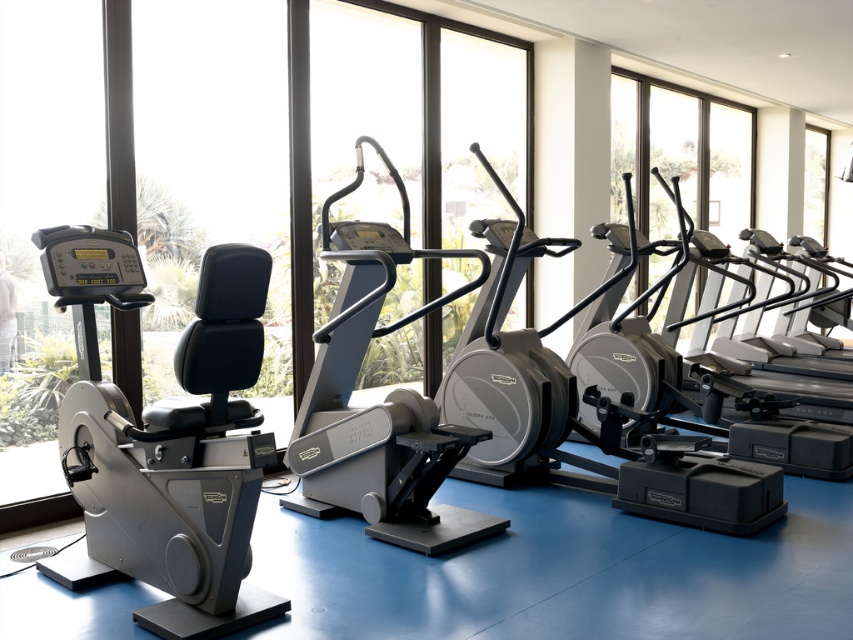
The image size is (853, 640). In order to click on matte black exercise bike at left in this screenshot , I will do `click(170, 440)`.

Does point (202, 516) come farther from viewer compared to point (662, 204)?

No, (202, 516) is in front of (662, 204).

The height and width of the screenshot is (640, 853). I want to click on matte black exercise bike at left, so click(170, 440).